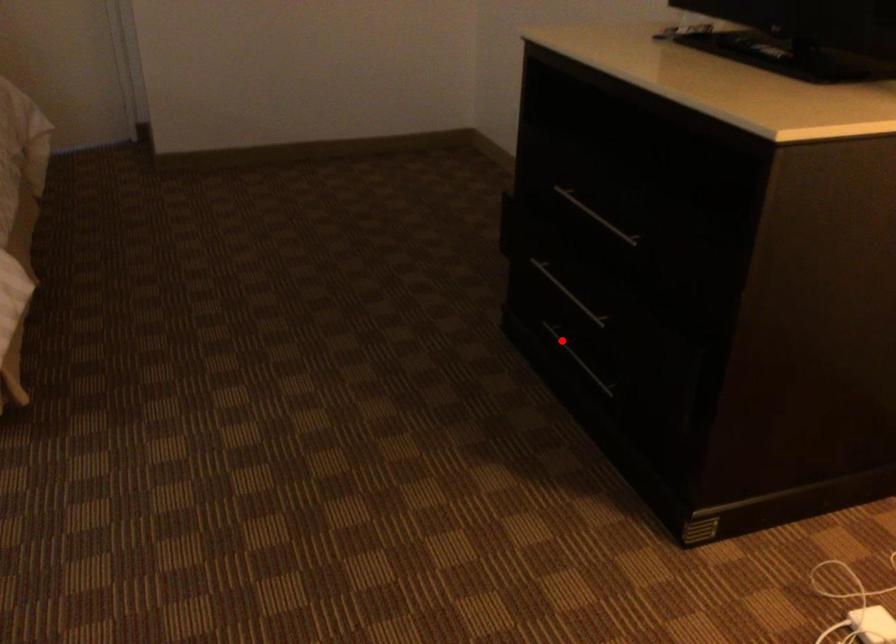
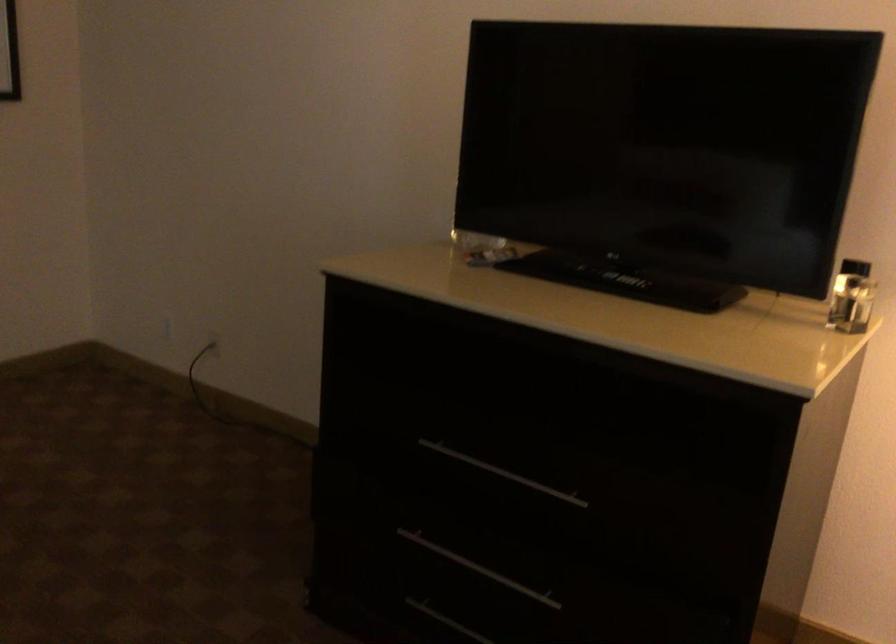
Question: I am providing you with two images of the same scene from different viewpoints. Given a red point in image1, look at the same physical point in image2. Is it:

Choices:
 (A) Closer to the viewpoint
 (B) Farther from the viewpoint

Answer: (A)